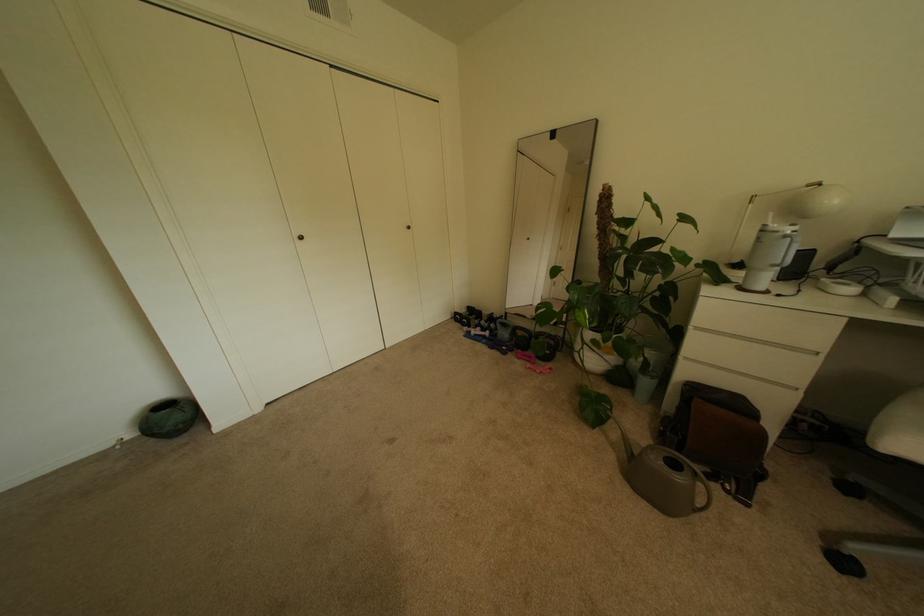
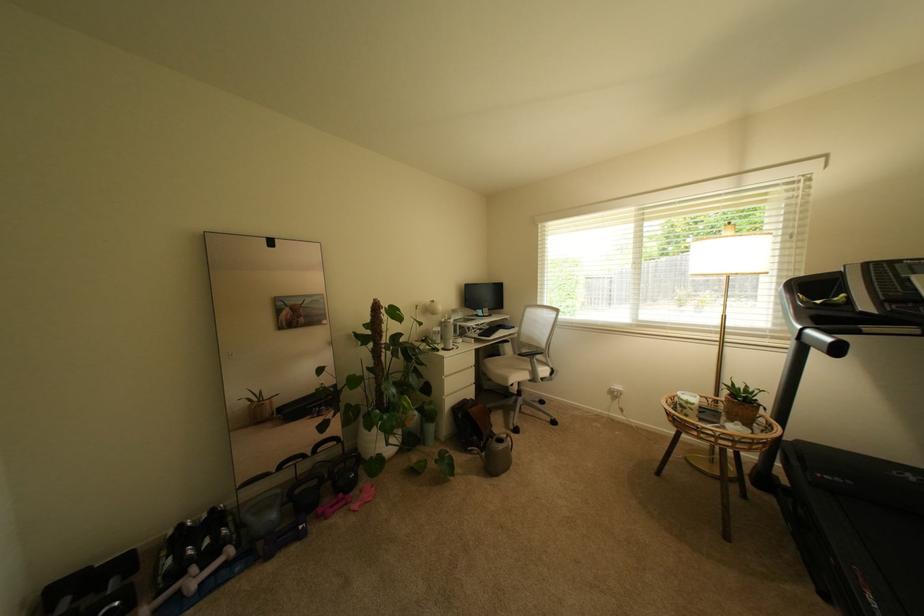
In the second image, find the point that corresponds to point 475,322 in the first image.

(126, 604)